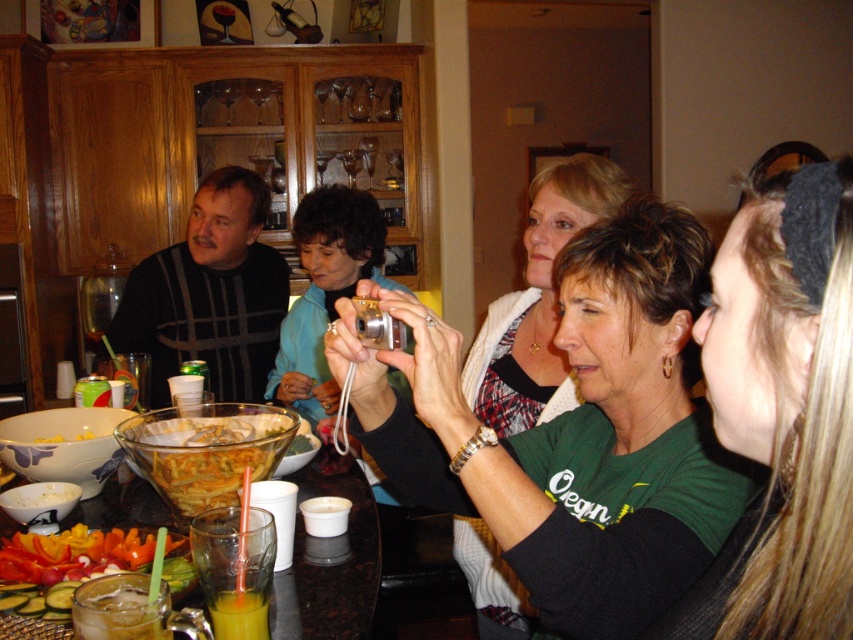
Question: Which point is farther to the camera?

Choices:
 (A) (225, 595)
 (B) (358, 488)
 (C) (231, 404)

Answer: (B)

Question: Does green matte shirt at center appear on the right side of ice clear glass at lower left?

Choices:
 (A) no
 (B) yes

Answer: (B)

Question: Which point is farther to the camera?

Choices:
 (A) dark green fabric headband at upper right
 (B) green matte shirt at center
 (C) translucent glass table at center

Answer: (C)

Question: Is the position of ice clear glass at lower left less distant than that of yellow matte corn at center?

Choices:
 (A) yes
 (B) no

Answer: (A)

Question: In this image, where is translucent glass table at center located relative to ice clear glass at lower left?

Choices:
 (A) above
 (B) below

Answer: (A)

Question: Which of the following is the closest to the observer?

Choices:
 (A) (647, 321)
 (B) (164, 596)
 (C) (59, 436)

Answer: (B)